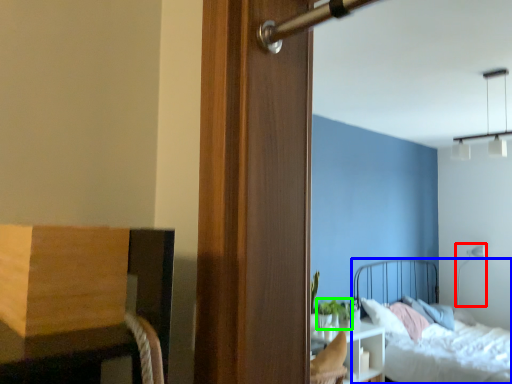
Question: Which object is the farthest from light fixture (highlighted by a red box)? Choose among these: bed (highlighted by a blue box) or plant (highlighted by a green box).

Choices:
 (A) bed
 (B) plant

Answer: (B)